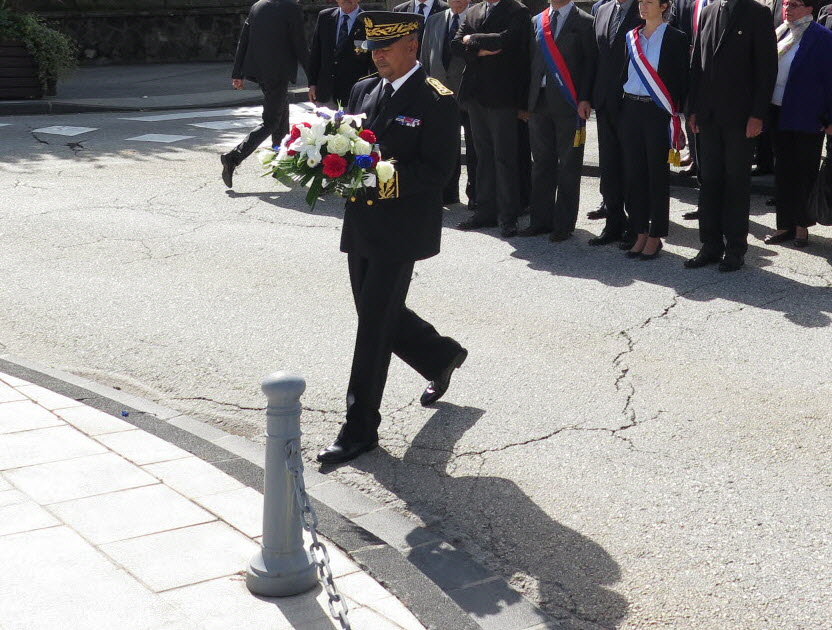
Where is `bouquet`? This screenshot has width=832, height=630. bouquet is located at coordinates (325, 142).